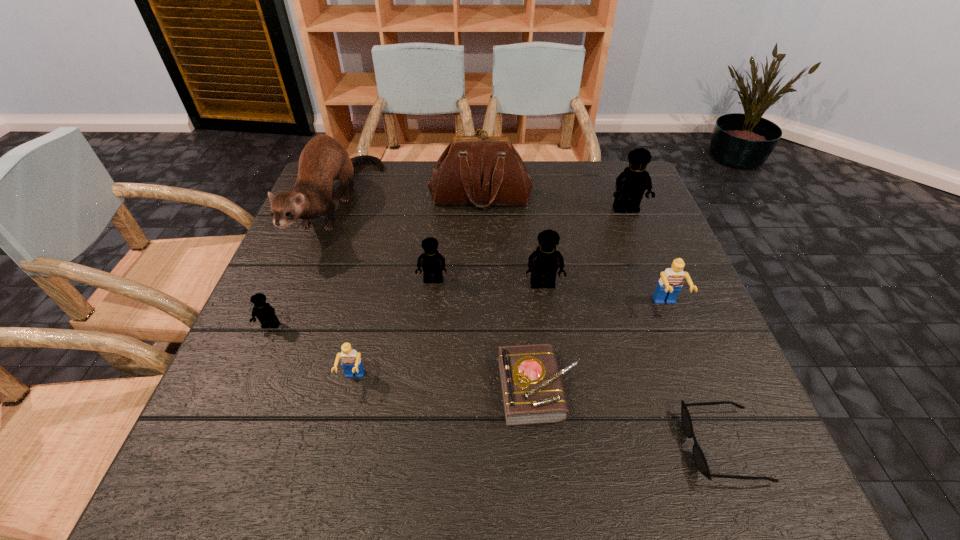
Where is `vacant area that lies between the farther blue Lego and the rightmost yellow Lego`? This screenshot has width=960, height=540. vacant area that lies between the farther blue Lego and the rightmost yellow Lego is located at coordinates (646, 258).

You are a GUI agent. You are given a task and a screenshot of the screen. Output one action in this format:
    pyautogui.click(x=<x>, y=<y>)
    Task: Click on the free space that is in between the farther blue Lego and the diary
    The width and height of the screenshot is (960, 540).
    Given the screenshot: What is the action you would take?
    (602, 347)

Find the location of `vacant area that lies between the third nearest Lego and the leftmost yellow Lego`. vacant area that lies between the third nearest Lego and the leftmost yellow Lego is located at coordinates (468, 316).

This screenshot has height=540, width=960. What are the coordinates of `object that ranks as the ninth closest to the tallest Lego` in the screenshot? It's located at (265, 313).

At what (x,y) coordinates should I click in order to perform the action: click on object that can be found as the third closest to the third Lego from right to left. Please return your answer as a coordinate pair (x, y). The height and width of the screenshot is (540, 960). Looking at the image, I should click on (669, 285).

Identify which Lego is located as the nearest to the second smallest yellow Lego. Please provide its 2D coordinates. Your answer should be formatted as a tuple, i.e. [(x, y)], where the tuple contains the x and y coordinates of a point satisfying the conditions above.

[(543, 263)]

Select which Lego is the fifth closest to the ferret. Please provide its 2D coordinates. Your answer should be formatted as a tuple, i.e. [(x, y)], where the tuple contains the x and y coordinates of a point satisfying the conditions above.

[(631, 184)]

Where is `yellow Lego that is the closest to the seventh shortest object`? The width and height of the screenshot is (960, 540). yellow Lego that is the closest to the seventh shortest object is located at coordinates (432, 263).

Locate an element on the screen. The width and height of the screenshot is (960, 540). yellow Lego that is the third closest one to the nearest yellow Lego is located at coordinates pos(631,184).